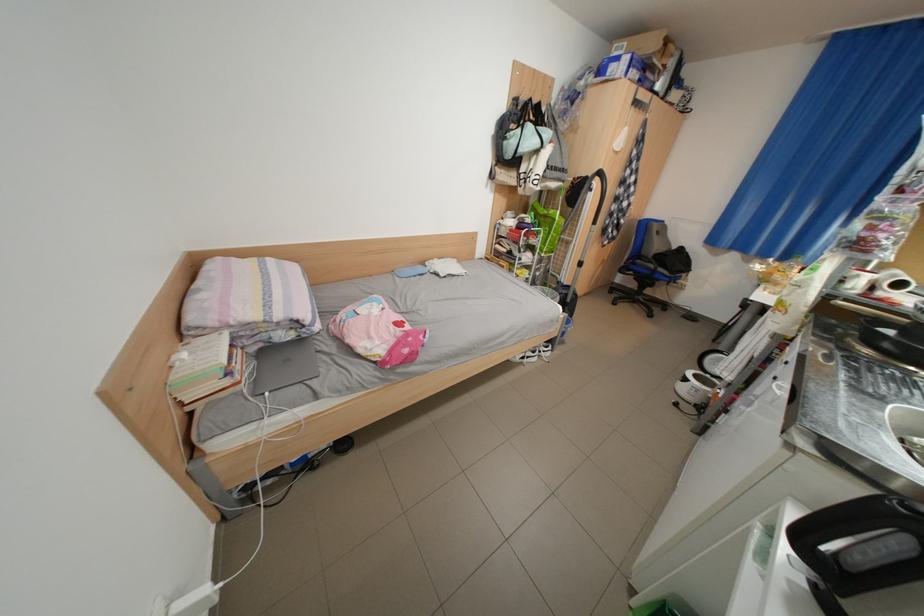
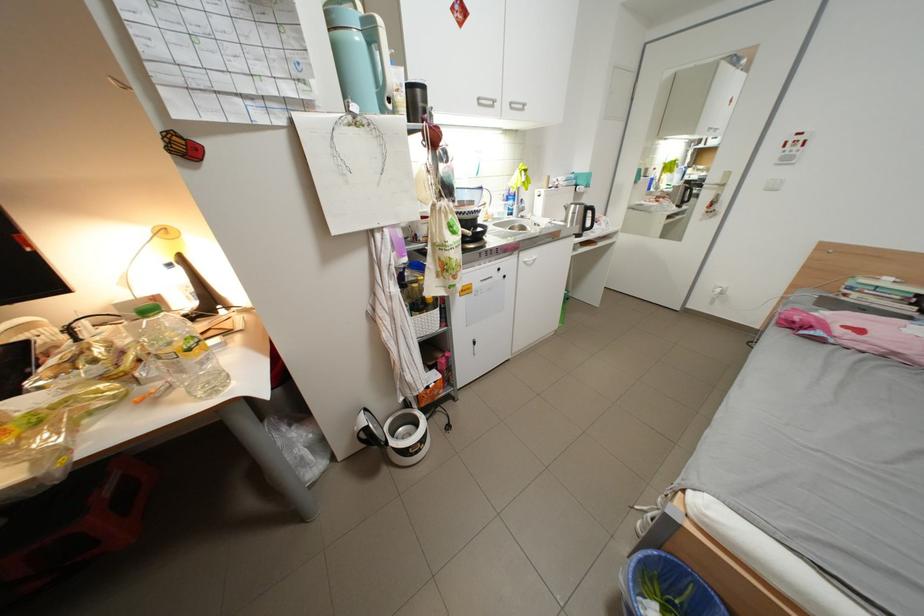
Find the pixel in the second image that matches (712,374) in the first image.

(404, 444)